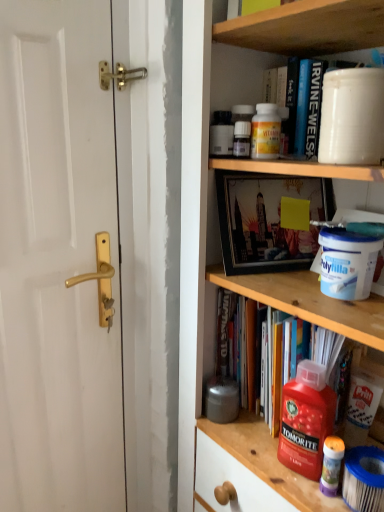
Question: Considering their positions, is white plastic container at upper center, the first cabinet in the bottom-to-top sequence, located in front of or behind white glossy door handle at left?

Choices:
 (A) front
 (B) behind

Answer: (B)

Question: Choose the correct answer: Is white plastic container at upper center, the first cabinet in the bottom-to-top sequence, inside white glossy door handle at left or outside it?

Choices:
 (A) outside
 (B) inside

Answer: (A)

Question: Which is farther from the wooden shelf at upper center, which is the 2th cabinet from bottom to top?

Choices:
 (A) red plastic bottle at lower center, the second cleaning product viewed from the top
 (B) wooden at center
 (C) matte black bottle at upper center
 (D) white plastic container at upper center, the first cabinet in the bottom-to-top sequence
 (E) hardcover book at center

Answer: (A)

Question: Which is farther from the white glossy door handle at left?

Choices:
 (A) matte black bottle at upper center
 (B) wooden at center
 (C) wooden shelf at upper center, which is the first cabinet from top to bottom
 (D) hardcover book at center
 (E) white plastic container at upper center, the second cabinet in the top-to-bottom sequence

Answer: (C)